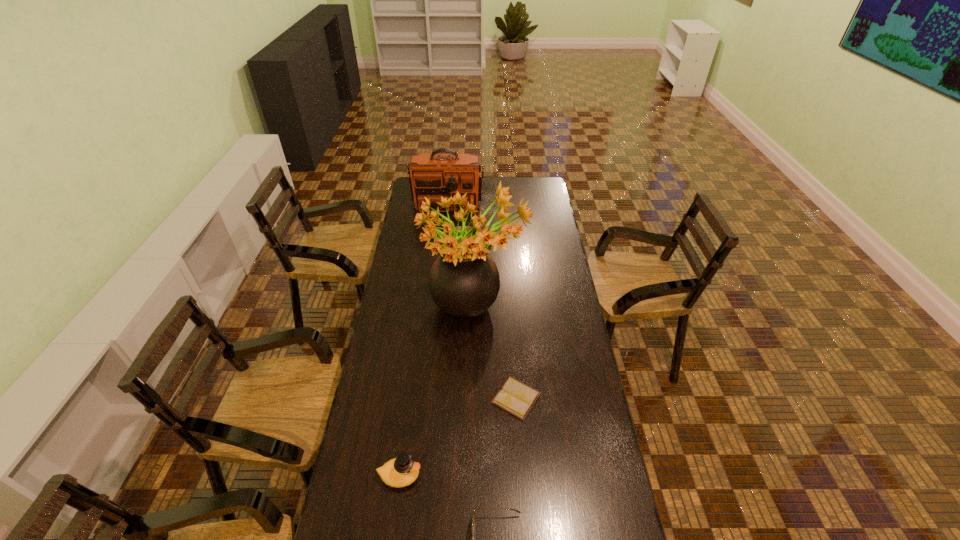
Where is `free space located on the front-facing side of the duck`? The width and height of the screenshot is (960, 540). free space located on the front-facing side of the duck is located at coordinates (523, 476).

At what (x,y) coordinates should I click in order to perform the action: click on free space located on the left of the third nearest object. Please return your answer as a coordinate pair (x, y). Looking at the image, I should click on (406, 398).

The image size is (960, 540). I want to click on object that is at the far edge, so click(434, 175).

The image size is (960, 540). Find the location of `satchel that is at the left edge`. satchel that is at the left edge is located at coordinates 434,175.

I want to click on duck present at the left edge, so click(401, 471).

Locate an element on the screen. Image resolution: width=960 pixels, height=540 pixels. object that is at the far left corner is located at coordinates (434, 175).

Identify the location of free space at the left edge of the desktop. (390, 340).

You are a GUI agent. You are given a task and a screenshot of the screen. Output one action in this format:
    pyautogui.click(x=<x>, y=<y>)
    Task: Click on the free space at the right edge of the desktop
    The height and width of the screenshot is (540, 960).
    Given the screenshot: What is the action you would take?
    pyautogui.click(x=546, y=295)

At what (x,y) coordinates should I click in order to perform the action: click on free space that is in between the shortest object and the fourth nearest object. Please return your answer as a coordinate pair (x, y). Image resolution: width=960 pixels, height=540 pixels. Looking at the image, I should click on (495, 353).

Locate an element on the screen. This screenshot has height=540, width=960. unoccupied area between the fourth nearest object and the duck is located at coordinates (437, 392).